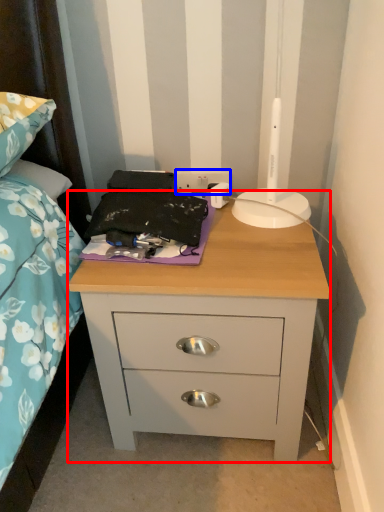
Question: Which object is further to the camera taking this photo, nightstand (highlighted by a red box) or electric outlet (highlighted by a blue box)?

Choices:
 (A) nightstand
 (B) electric outlet

Answer: (B)